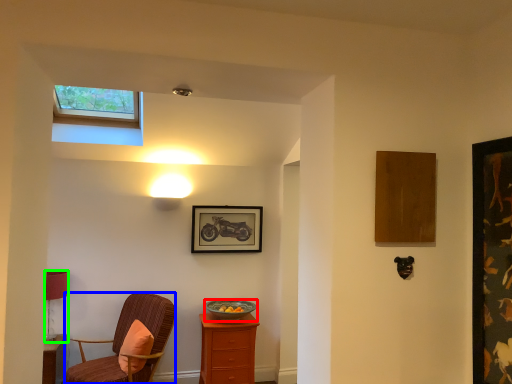
Question: Which object is the farthest from bowl (highlighted by a red box)? Choose among these: chair (highlighted by a blue box) or lamp (highlighted by a green box).

Choices:
 (A) chair
 (B) lamp

Answer: (B)